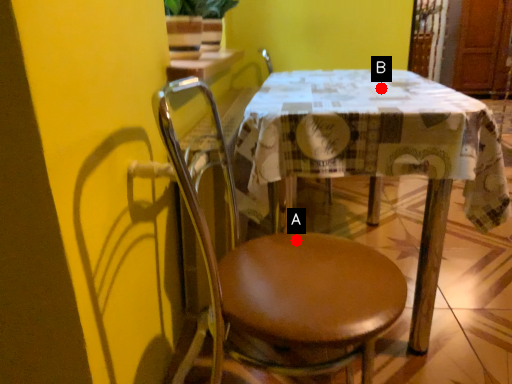
Question: Two points are circled on the image, labeled by A and B beside each circle. Which point appears closest to the camera in this image?

Choices:
 (A) A is closer
 (B) B is closer

Answer: (A)